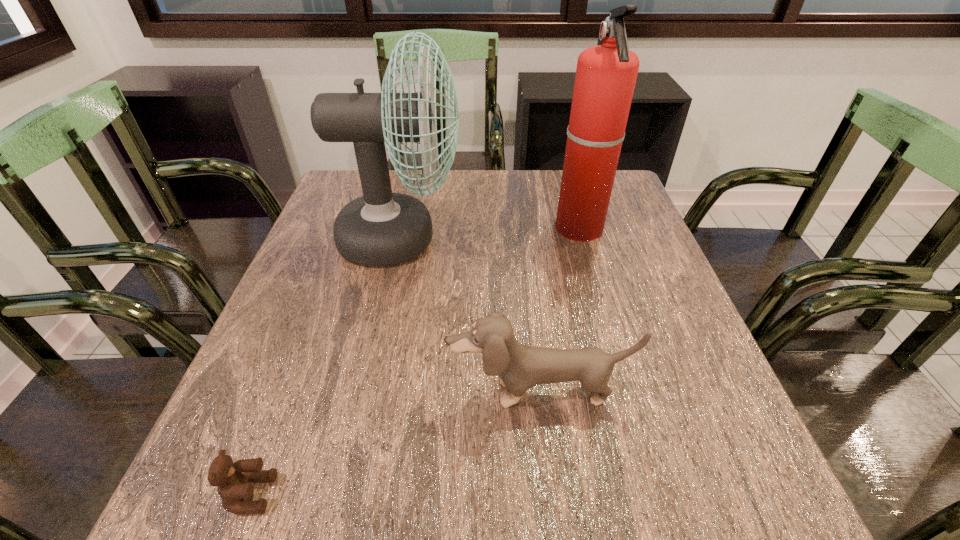
Locate an element on the screen. The height and width of the screenshot is (540, 960). object present at the far right corner is located at coordinates (606, 74).

At what (x,y) coordinates should I click in order to perform the action: click on free space at the far edge. Please return your answer as a coordinate pair (x, y). Image resolution: width=960 pixels, height=540 pixels. Looking at the image, I should click on (550, 203).

Find the location of a particular element. The width and height of the screenshot is (960, 540). vacant space at the near edge of the desktop is located at coordinates (434, 496).

Identify the location of vacant point at the left edge. The height and width of the screenshot is (540, 960). (276, 313).

The height and width of the screenshot is (540, 960). I want to click on vacant space at the right edge of the desktop, so click(685, 398).

Image resolution: width=960 pixels, height=540 pixels. In the image, there is a desktop. Find the location of `vacant space at the far left corner`. vacant space at the far left corner is located at coordinates (348, 180).

The height and width of the screenshot is (540, 960). In order to click on vacant space at the near right corner of the desktop in this screenshot , I will do `click(766, 505)`.

The height and width of the screenshot is (540, 960). What are the coordinates of `free space between the fire extinguisher and the nearest object` in the screenshot? It's located at (415, 361).

This screenshot has height=540, width=960. I want to click on unoccupied area between the fire extinguisher and the fan, so click(x=490, y=234).

This screenshot has width=960, height=540. I want to click on free area in between the second shortest object and the fire extinguisher, so click(x=560, y=310).